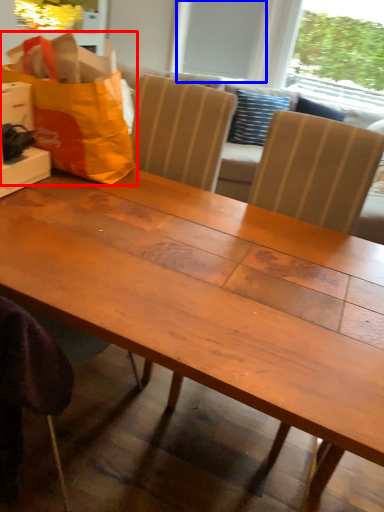
Question: Among these objects, which one is nearest to the camera, grocery bag (highlighted by a red box) or window screen (highlighted by a blue box)?

Choices:
 (A) grocery bag
 (B) window screen

Answer: (A)